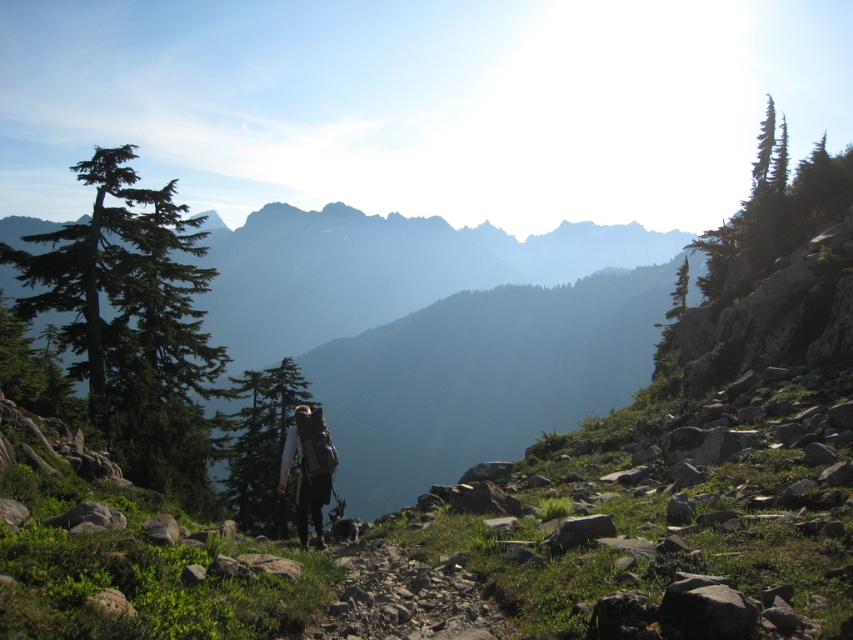
You are a hiker planning to take a photo of both the green matte evergreen tree at left and the green textured tree at upper right. Which tree should you position yourself closer to in order to capture both in the same frame?

You should position yourself closer to the green textured tree at upper right because the green matte evergreen tree at left is to the left of it, so moving towards the right tree will allow both to be in the frame.

You are a hiker planning to take a photo of the green textured pine tree at upper right and the green textured tree at upper right from the rocky trail. Which tree should you position yourself closer to in order to capture both in a single frame?

Since the green textured pine tree at upper right is above the green textured tree at upper right, you should position yourself closer to the green textured tree at upper right to include both in your photo.